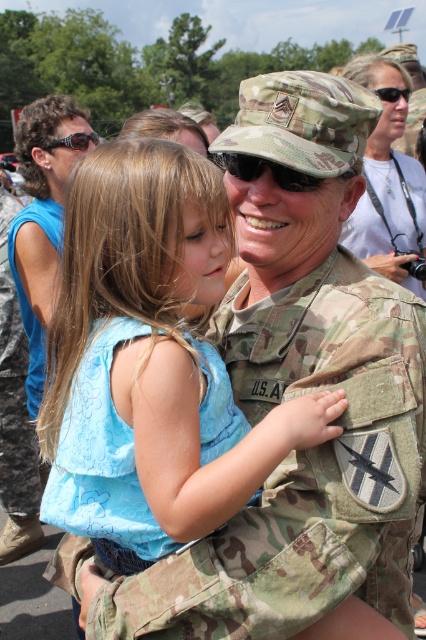
Between point (175, 369) and point (37, 128), which one is positioned in front?

Point (175, 369) is more forward.

Which is above, blue fabric dress at center or camouflage uniform at center?

camouflage uniform at center

In order to click on blue fabric dress at center in this screenshot , I will do `click(150, 362)`.

Find the location of `blue fabric dress at center`. blue fabric dress at center is located at coordinates (150, 362).

Does camouflage uniform at center appear over matte white shirt at upper center?

No.

Who is more forward, (43, 237) or (368, 170)?

Point (43, 237) is more forward.

The width and height of the screenshot is (426, 640). I want to click on camouflage uniform at center, so [42, 221].

The width and height of the screenshot is (426, 640). Identify the location of camouflage uniform at center. [42, 221].